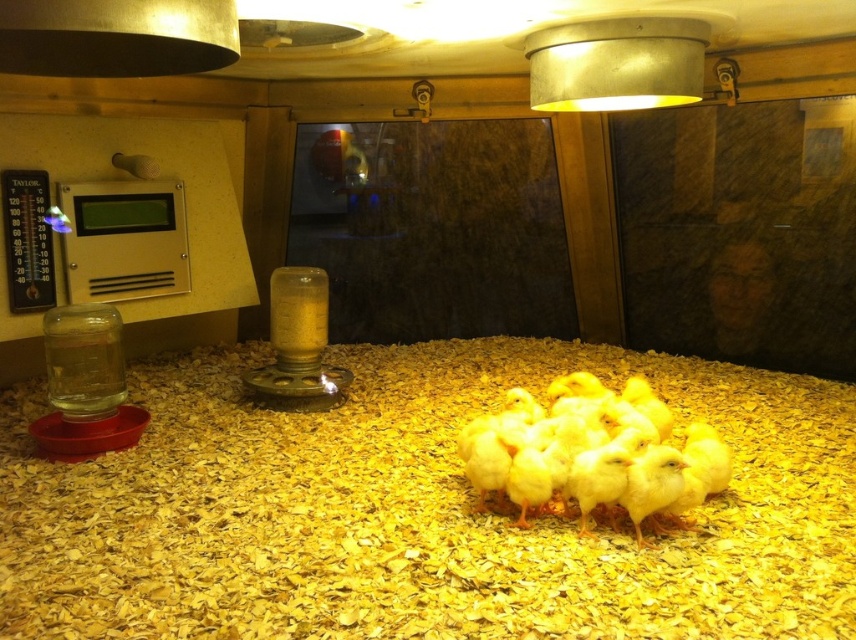
You are a farmer checking on the baby chicks in the enclosure. You notice the yellow wood chips at center and the yellow matte chicken at center. Which object is closer to you from your current viewpoint?

The yellow wood chips at center are closer to you because they are in front of the yellow matte chicken at center from your viewpoint.